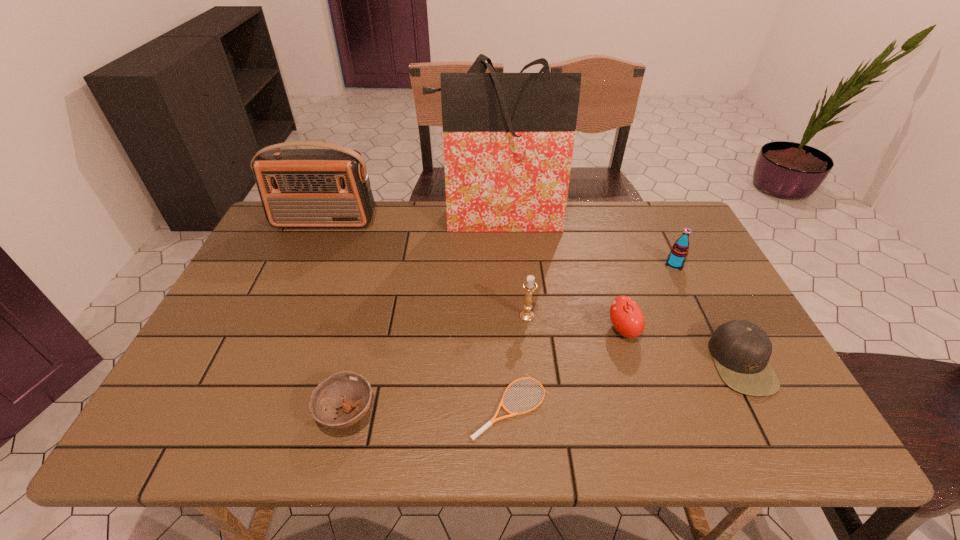
Find the location of a particular element. vacant space at the far right corner of the desktop is located at coordinates (675, 221).

Image resolution: width=960 pixels, height=540 pixels. I want to click on free space between the fourth shortest object and the cap, so click(x=682, y=347).

Locate an element on the screen. vacant space that is in between the third farthest object and the sixth object from left to right is located at coordinates (649, 297).

Where is `free space between the bowl and the sixth object from left to right`? The height and width of the screenshot is (540, 960). free space between the bowl and the sixth object from left to right is located at coordinates (485, 372).

The width and height of the screenshot is (960, 540). I want to click on free space between the candle holder and the seventh tallest object, so click(437, 364).

At what (x,y) coordinates should I click in order to perform the action: click on unoccupied position between the sixth nearest object and the shortest object. Please return your answer as a coordinate pair (x, y). Image resolution: width=960 pixels, height=540 pixels. Looking at the image, I should click on 592,335.

You are a GUI agent. You are given a task and a screenshot of the screen. Output one action in this format:
    pyautogui.click(x=<x>, y=<y>)
    Task: Click on the vacant space that is in between the fourth shortest object and the cap
    
    Given the screenshot: What is the action you would take?
    pyautogui.click(x=682, y=347)

Where is `free space between the sixth nearest object and the third shortest object`? free space between the sixth nearest object and the third shortest object is located at coordinates (708, 313).

Locate an element on the screen. vacant area that lies between the fourth shortest object and the sixth nearest object is located at coordinates (649, 297).

This screenshot has height=540, width=960. In order to click on free point between the candle holder and the third farthest object in this screenshot , I will do `click(601, 290)`.